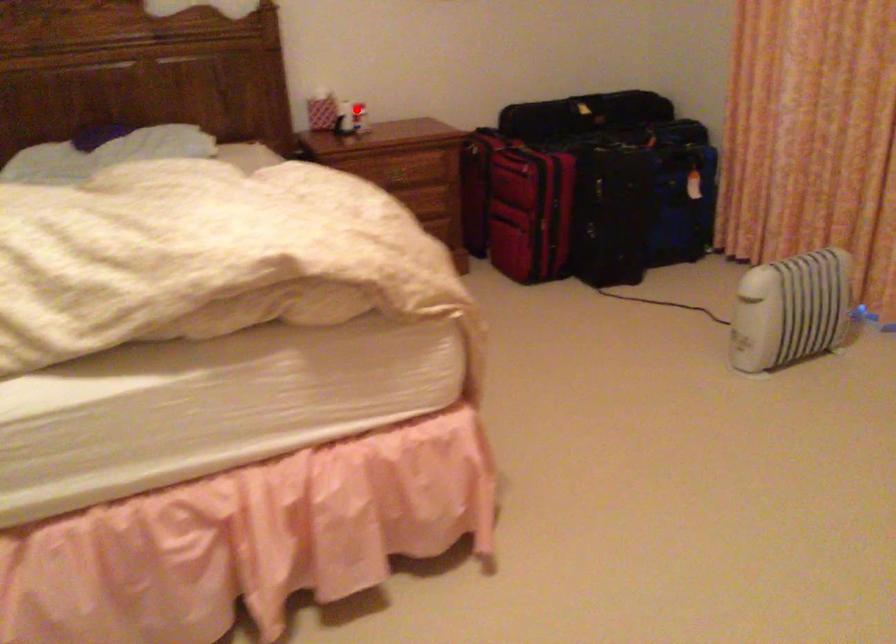
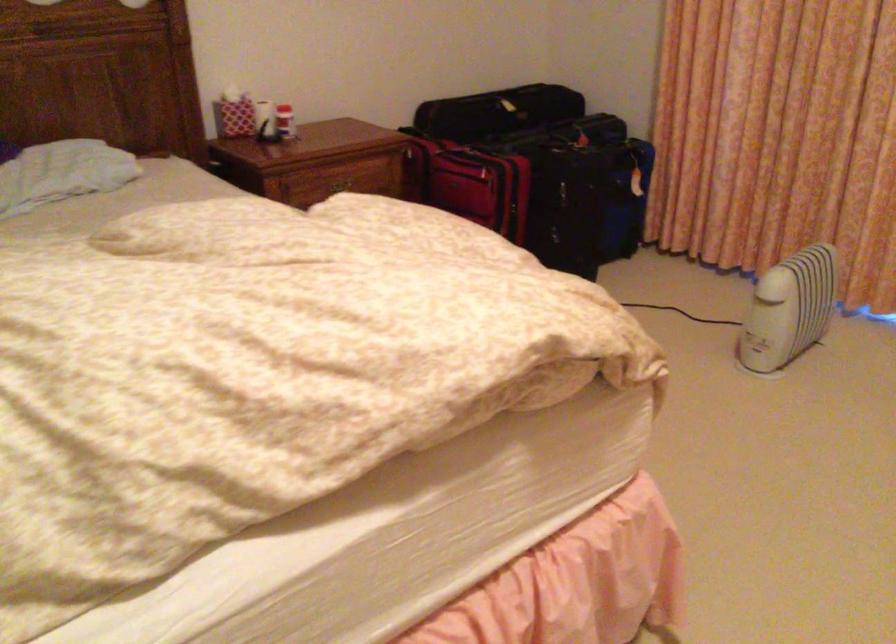
Locate, in the second image, the point that corresponds to the highlighted location in the first image.

(285, 122)